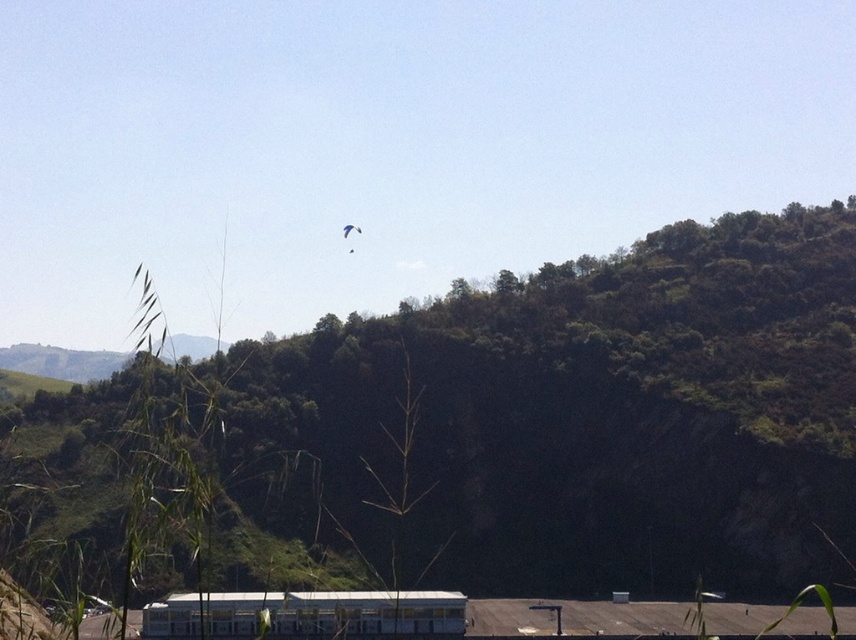
Question: Is green leafy tree at upper center to the left of white matte passenger train at lower center from the viewer's perspective?

Choices:
 (A) no
 (B) yes

Answer: (B)

Question: Which object is farther from the camera taking this photo?

Choices:
 (A) green leafy tree at upper center
 (B) white matte passenger train at lower center

Answer: (B)

Question: In this image, where is green leafy tree at upper center located relative to white matte passenger train at lower center?

Choices:
 (A) below
 (B) above

Answer: (B)

Question: Which of the following is the farthest from the observer?

Choices:
 (A) (173, 618)
 (B) (486, 486)

Answer: (B)

Question: Is the position of green leafy tree at upper center more distant than that of white matte passenger train at lower center?

Choices:
 (A) no
 (B) yes

Answer: (A)

Question: Which object appears farthest from the camera in this image?

Choices:
 (A) green leafy tree at upper center
 (B) white matte passenger train at lower center

Answer: (B)